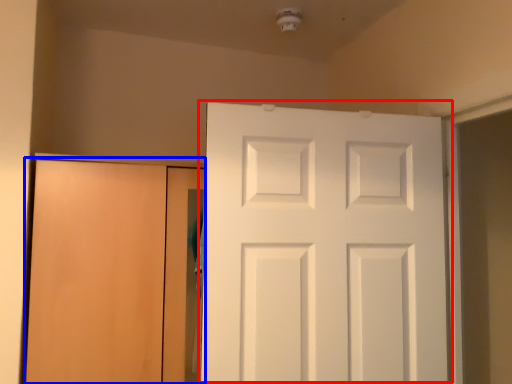
Question: Which of the following is the farthest to the observer, door (highlighted by a red box) or door (highlighted by a blue box)?

Choices:
 (A) door
 (B) door

Answer: (B)